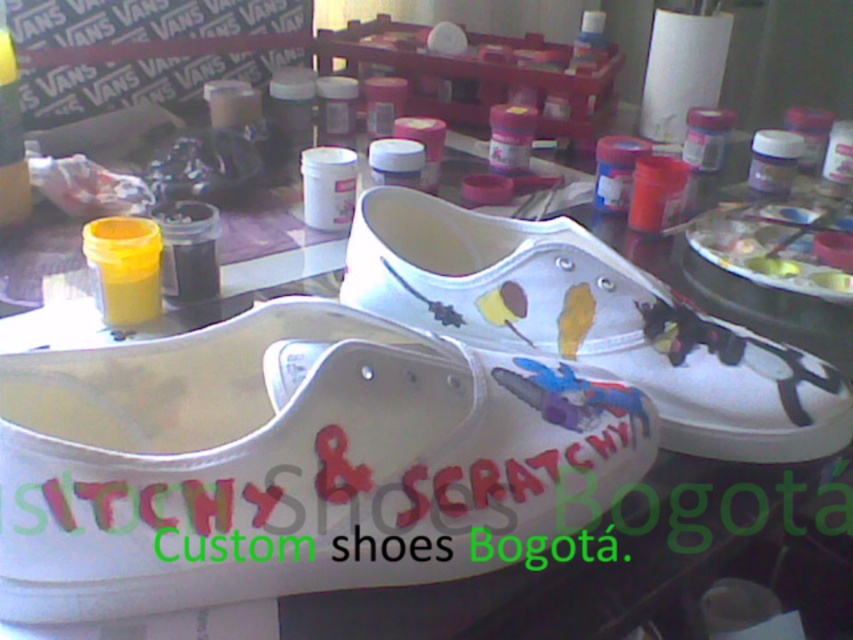
This screenshot has width=853, height=640. What do you see at coordinates (292, 464) in the screenshot?
I see `white matte shoe at center` at bounding box center [292, 464].

Is white matte shoe at center closer to camera compared to hand-painted text at center?

Yes, white matte shoe at center is in front of hand-painted text at center.

Locate an element on the screen. This screenshot has width=853, height=640. white matte shoe at center is located at coordinates (292, 464).

Image resolution: width=853 pixels, height=640 pixels. Find the location of `white matte shoe at center`. white matte shoe at center is located at coordinates (292, 464).

Image resolution: width=853 pixels, height=640 pixels. What do you see at coordinates (292, 464) in the screenshot?
I see `white matte shoe at center` at bounding box center [292, 464].

Is white matte shoe at center smaller than white canvas shoe at center?

Indeed, white matte shoe at center has a smaller size compared to white canvas shoe at center.

Who is more forward, [48,534] or [596,365]?

Point [48,534]

Where is `white matte shoe at center`? The image size is (853, 640). white matte shoe at center is located at coordinates (292, 464).

Locate an element on the screen. hand-painted text at center is located at coordinates (314, 490).

Does hand-painted text at center come in front of white canvas shoe at center?

Yes, it is.

Image resolution: width=853 pixels, height=640 pixels. Find the location of `hand-painted text at center`. hand-painted text at center is located at coordinates (314, 490).

The width and height of the screenshot is (853, 640). I want to click on hand-painted text at center, so pyautogui.click(x=314, y=490).